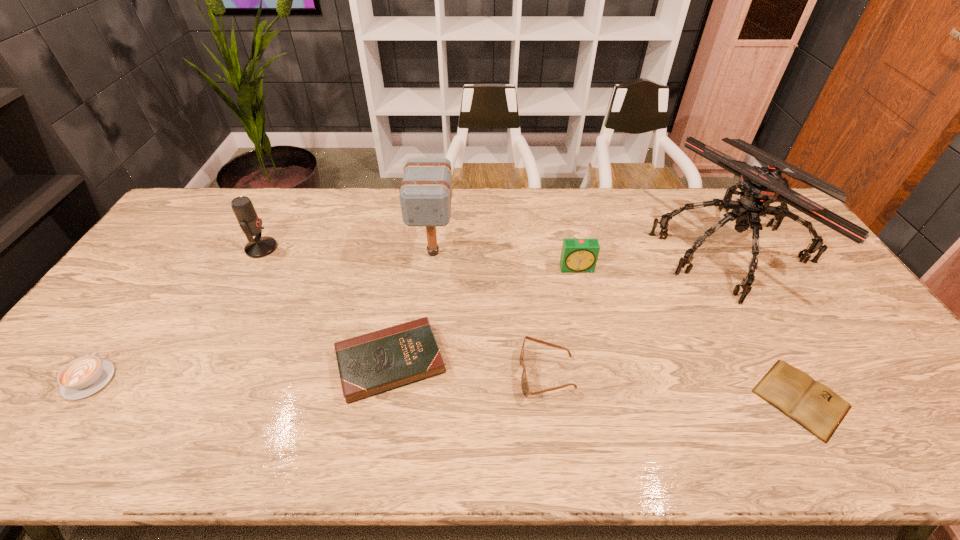
Locate an element on the screen. The image size is (960, 540). drone is located at coordinates (760, 186).

Image resolution: width=960 pixels, height=540 pixels. I want to click on mallet, so click(x=425, y=195).

Where is `microphone`? This screenshot has width=960, height=540. microphone is located at coordinates (260, 246).

At what (x,y) coordinates should I click in order to perform the action: click on the third tallest object. Please return your answer as a coordinate pair (x, y). The height and width of the screenshot is (540, 960). Looking at the image, I should click on (260, 246).

You are a GUI agent. You are given a task and a screenshot of the screen. Output one action in this format:
    pyautogui.click(x=<x>, y=<y>)
    Task: Click on the sixth object from left to right
    The image size is (960, 540).
    Given the screenshot: What is the action you would take?
    pyautogui.click(x=579, y=255)

At what (x,y) coordinates should I click in order to perform the action: click on alarm clock. Please return your answer as a coordinate pair (x, y). The width and height of the screenshot is (960, 540). Looking at the image, I should click on (579, 255).

Locate an element on the screen. sunglasses is located at coordinates (525, 386).

The image size is (960, 540). I want to click on the fifth tallest object, so [525, 386].

This screenshot has width=960, height=540. In order to click on cappuccino in this screenshot , I will do `click(82, 377)`.

Identify the location of Bible. click(x=374, y=363).